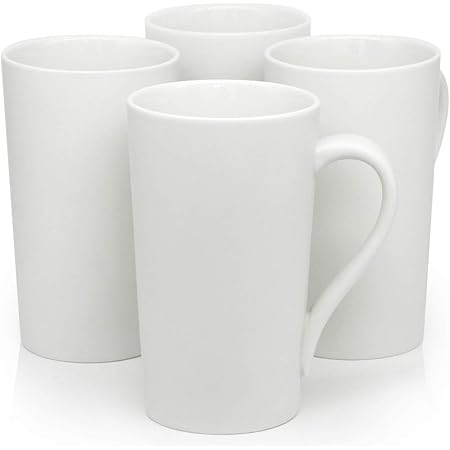
Locate an element on the screen. This screenshot has height=450, width=450. tall white mug is located at coordinates (379, 81), (232, 21), (81, 91), (211, 158).